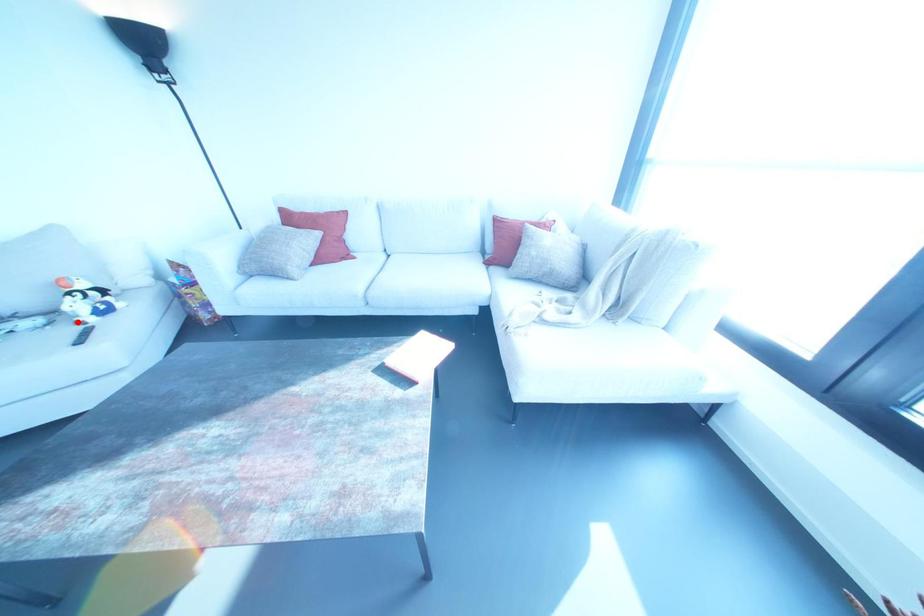
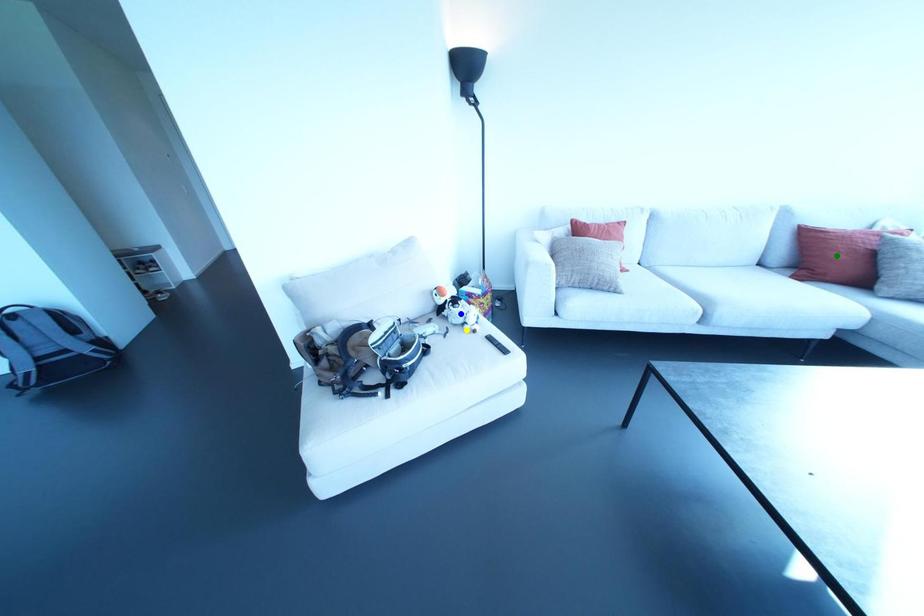
Question: I am providing you with two images of the same scene from different viewpoints. A red point is marked on the first image. You are given multiple points on the second image. Which point in image 2 is actually the same real-world point as the red point in image 1?

Choices:
 (A) yellow point
 (B) blue point
 (C) green point

Answer: (A)